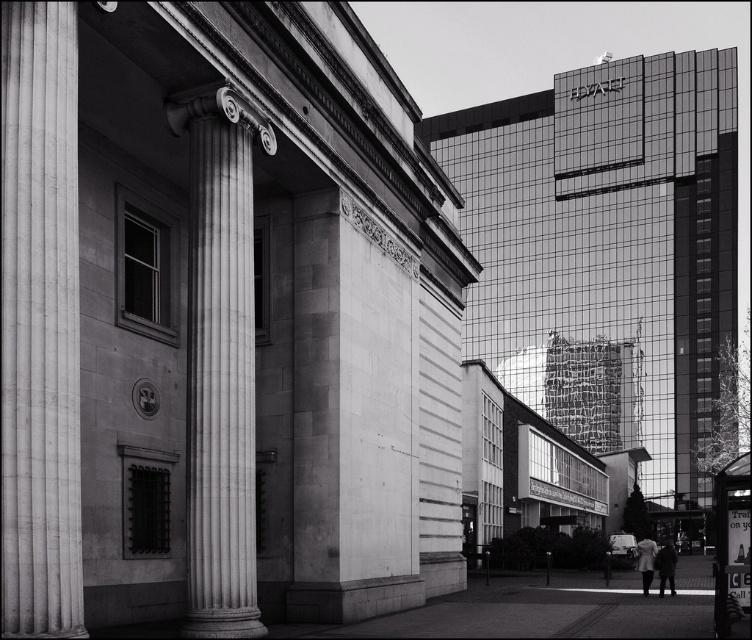
You are an architect analyzing the spatial arrangement of the classical building. You notice two columns, the smooth stone column at left and the white marble column at center. Which column is positioned closer to the entrance of the building?

The smooth stone column at left is closer to the viewer than the white marble column at center, so the smooth stone column at left is positioned closer to the entrance of the building.

You are standing at the base of the smooth stone column at left and want to take a photo of it with a camera that has a maximum focusing distance of 15 meters. Can you capture the entire column in focus without moving closer?

The smooth stone column at left and camera are 17.82 meters apart from each other. Since the camera can only focus up to 15 meters, you cannot capture the entire column in focus without moving closer.

You are an architect analyzing the structural integrity of the columns in this urban scene. Given that the smooth stone column at left is narrower than the white marble column at center, which column would you expect to support more weight and why?

The white marble column at center is wider than the smooth stone column at left, so it can support more weight due to its larger cross sectional area.